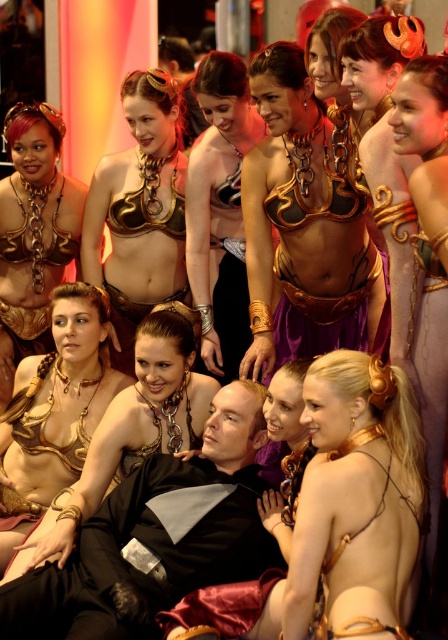
You are organizing a costume contest where each contestant must wear a costume that is at least 1.5 meters in height. You see the gold chainmail bikini at center and the black matte suit at center. Based on their sizes, which costume might not meet the height requirement?

The gold chainmail bikini at center is smaller than the black matte suit at center, so it might not meet the height requirement.

You are a photographer at the event and want to capture both the gold chainmail bikini at center and the black matte suit at center in the same frame. Which costume should you position closer to the left side of your camera to ensure both are visible?

You should position the black matte suit at center closer to the left side of your camera since the gold chainmail bikini at center is already to the right of it. This way, both costumes will be visible in the frame.